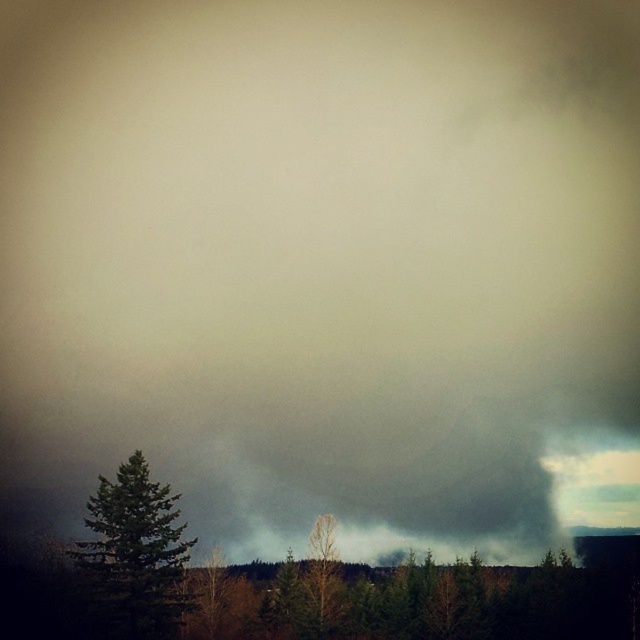
Question: Which point is closer to the camera?

Choices:
 (A) green matte trees at lower center
 (B) green matte tree at lower left

Answer: (A)

Question: Among these points, which one is nearest to the camera?

Choices:
 (A) (339, 593)
 (B) (182, 573)
 (C) (22, 579)

Answer: (B)

Question: Is green matte trees at lower center above green matte tree at lower left?

Choices:
 (A) yes
 (B) no

Answer: (B)

Question: Does green matte tree at lower left come in front of green matte tree at center?

Choices:
 (A) no
 (B) yes

Answer: (B)

Question: Among these points, which one is nearest to the camera?

Choices:
 (A) (330, 576)
 (B) (172, 506)
 (C) (218, 589)

Answer: (B)

Question: Can you confirm if green matte trees at lower center is positioned to the right of green matte tree at lower left?

Choices:
 (A) no
 (B) yes

Answer: (B)